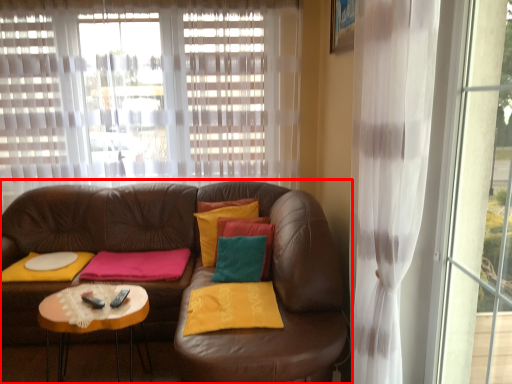
Question: From the image's perspective, what is the correct spatial relationship of studio couch (annotated by the red box) in relation to curtain?

Choices:
 (A) above
 (B) below

Answer: (B)